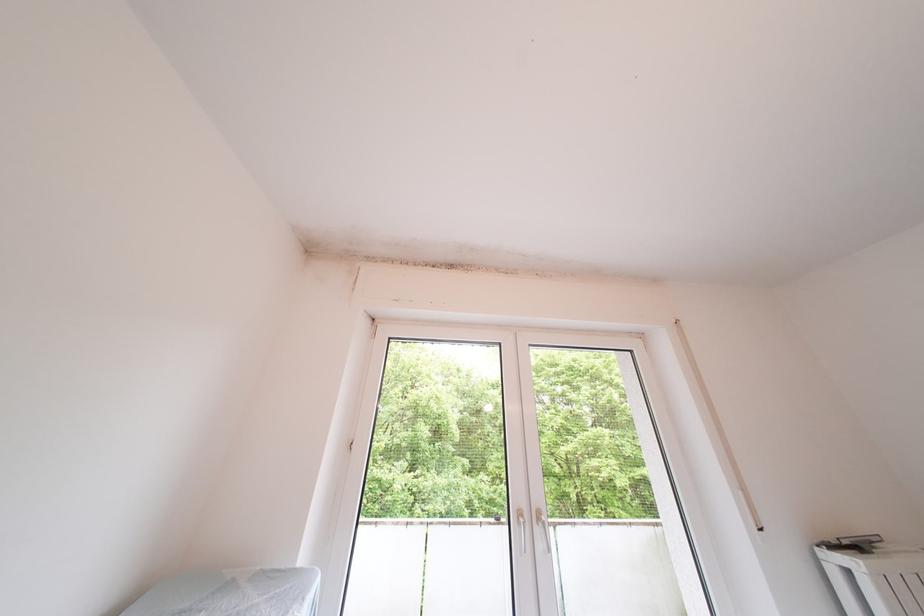
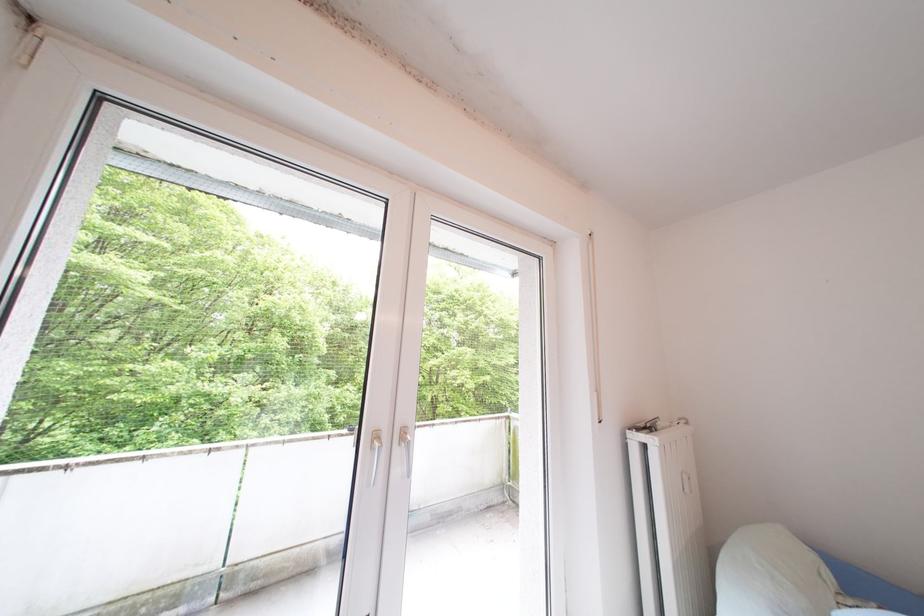
Question: The images are taken continuously from a first-person perspective. In which direction is your viewpoint rotating?

Choices:
 (A) Left
 (B) Right
 (C) Up
 (D) Down

Answer: (B)